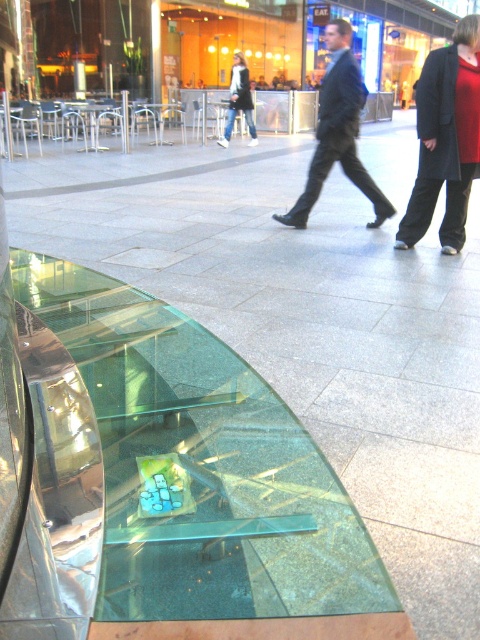
From the picture: Is transparent glass table at lower left further to the viewer compared to white fabric jacket at center?

That is False.

Measure the distance between point (301,445) and camera.

2.32 meters

Find the location of a particular element. This screenshot has height=640, width=480. transparent glass table at lower left is located at coordinates (204, 481).

Does transparent glass table at lower left have a larger size compared to dark blue suit at center?

Yes.

Is transparent glass table at lower left taller than dark blue suit at center?

Yes, transparent glass table at lower left is taller than dark blue suit at center.

You are a GUI agent. You are given a task and a screenshot of the screen. Output one action in this format:
    pyautogui.click(x=<x>, y=<y>)
    Task: Click on the transparent glass table at lower left
    The height and width of the screenshot is (640, 480).
    Given the screenshot: What is the action you would take?
    pyautogui.click(x=204, y=481)

Where is `transparent glass table at lower left`? Image resolution: width=480 pixels, height=640 pixels. transparent glass table at lower left is located at coordinates (204, 481).

Can you confirm if transparent glass table at lower left is positioned to the left of red woolen sweater at upper right?

Yes, transparent glass table at lower left is to the left of red woolen sweater at upper right.

Identify the location of transparent glass table at lower left. Image resolution: width=480 pixels, height=640 pixels. (204, 481).

You are a GUI agent. You are given a task and a screenshot of the screen. Output one action in this format:
    pyautogui.click(x=<x>, y=<y>)
    Task: Click on the transparent glass table at lower left
    This screenshot has width=480, height=640.
    Given the screenshot: What is the action you would take?
    pyautogui.click(x=204, y=481)